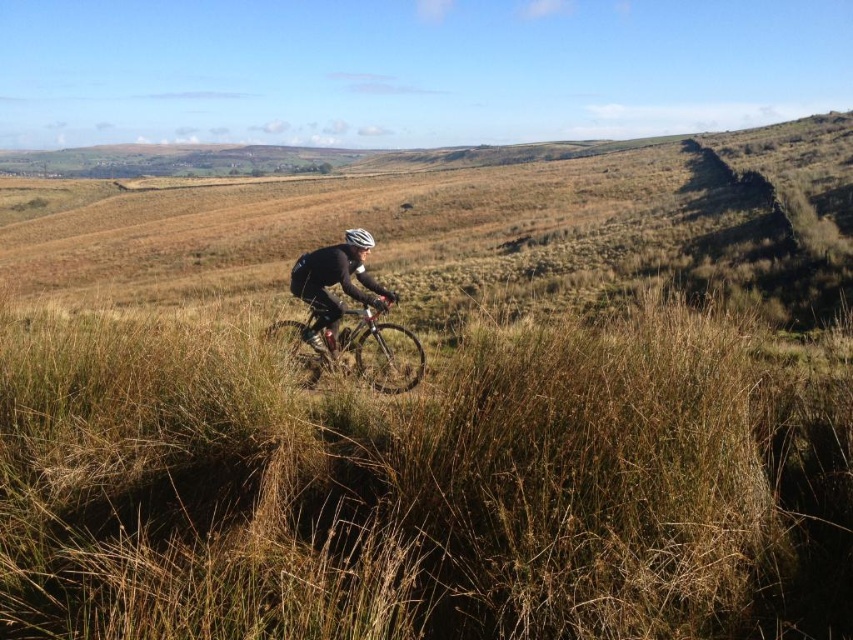
Based on the photo, is black matte jacket at center thinner than white textured helmet at center?

Indeed, black matte jacket at center has a lesser width compared to white textured helmet at center.

Does black matte jacket at center appear on the right side of white textured helmet at center?

Correct, you'll find black matte jacket at center to the right of white textured helmet at center.

Which is behind, point (332, 264) or point (360, 236)?

Positioned behind is point (360, 236).

Identify the location of black matte jacket at center. The image size is (853, 640). (334, 282).

Does brown dry grass at center lie in front of white textured helmet at center?

Yes.

Describe the element at coordinates (424, 486) in the screenshot. Image resolution: width=853 pixels, height=640 pixels. I see `brown dry grass at center` at that location.

Does point (77, 532) lie in front of point (364, 241)?

Yes, point (77, 532) is closer to viewer.

Identify the location of brown dry grass at center. Image resolution: width=853 pixels, height=640 pixels. (424, 486).

How much distance is there between brown dry grass at center and silver metallic mountain bike at center?

The distance of brown dry grass at center from silver metallic mountain bike at center is 2.29 meters.

Does point (22, 317) come farther from viewer compared to point (293, 323)?

Yes, point (22, 317) is farther from viewer.

Is point (463, 550) in front of point (271, 337)?

That is True.

At what (x,y) coordinates should I click in order to perform the action: click on brown dry grass at center. Please return your answer as a coordinate pair (x, y). This screenshot has height=640, width=853. Looking at the image, I should click on (424, 486).